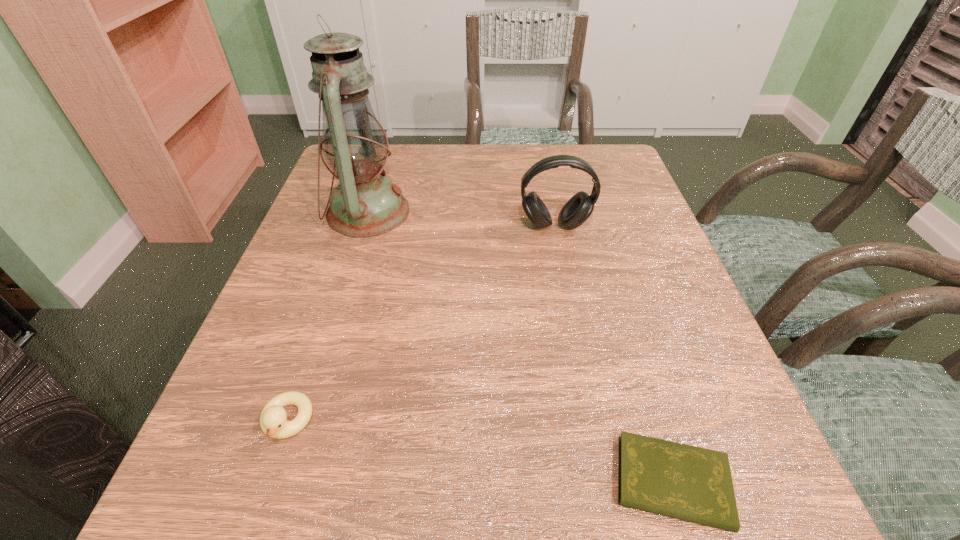
Where is `empty location between the diary and the duckling`? Image resolution: width=960 pixels, height=540 pixels. empty location between the diary and the duckling is located at coordinates (480, 451).

The image size is (960, 540). Identify the location of free space between the duckling and the third shortest object. (420, 323).

Locate an element on the screen. The height and width of the screenshot is (540, 960). object that is the second nearest to the headset is located at coordinates (694, 484).

Identify which object is the third nearest to the duckling. Please provide its 2D coordinates. Your answer should be formatted as a tuple, i.e. [(x, y)], where the tuple contains the x and y coordinates of a point satisfying the conditions above.

[(578, 208)]

Identify the location of vacant region that satisfies the following two spatial constraints: 1. at the beak of the second shortest object; 2. on the left side of the shortest object. The image size is (960, 540). (267, 482).

This screenshot has height=540, width=960. Find the location of `vacant region that satisfies the following two spatial constraints: 1. on the earcups of the diary; 2. on the left side of the headset`. vacant region that satisfies the following two spatial constraints: 1. on the earcups of the diary; 2. on the left side of the headset is located at coordinates (606, 482).

I want to click on free location that satisfies the following two spatial constraints: 1. on the earcups of the shortest object; 2. on the right side of the third shortest object, so click(606, 482).

The width and height of the screenshot is (960, 540). In order to click on vacant space that satisfies the following two spatial constraints: 1. at the beak of the duckling; 2. on the left side of the diary in this screenshot , I will do `click(267, 482)`.